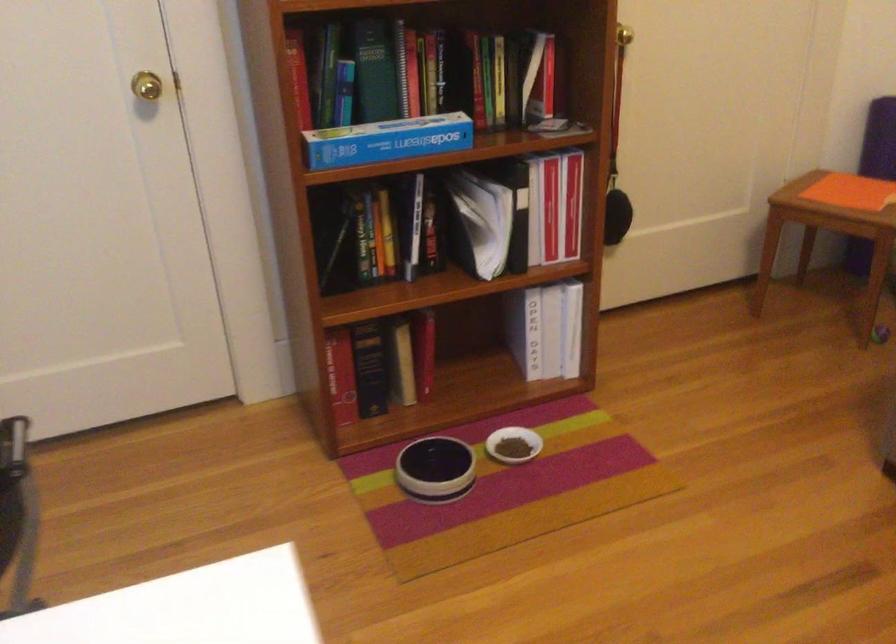
Find the location of a particular element. black binder is located at coordinates (479, 222).